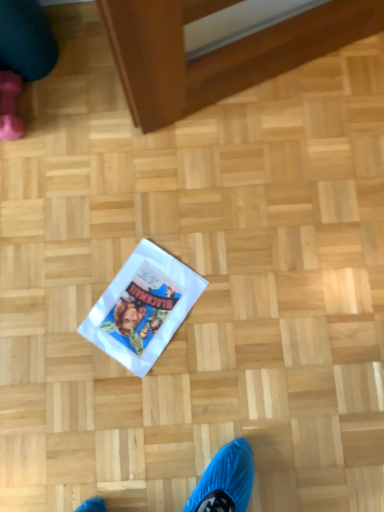
Locate an element on the screen. This screenshot has height=512, width=384. vacant area that lies between pink rubber boot at upper left and white paper flyer at center is located at coordinates (83, 206).